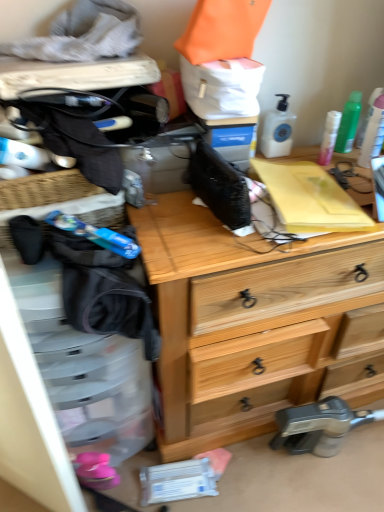
Question: Is green matte spray can at upper right, the 3th toiletry from the left, looking in the opposite direction of wooden chest of drawers at center?

Choices:
 (A) no
 (B) yes

Answer: (A)

Question: From a real-world perspective, is green matte spray can at upper right, the second toiletry when ordered from right to left, physically above wooden chest of drawers at center?

Choices:
 (A) no
 (B) yes

Answer: (B)

Question: Is green matte spray can at upper right, the second toiletry when ordered from right to left, not near wooden chest of drawers at center?

Choices:
 (A) yes
 (B) no

Answer: (B)

Question: Does green matte spray can at upper right, the 3th toiletry from the left, have a smaller size compared to wooden chest of drawers at center?

Choices:
 (A) no
 (B) yes

Answer: (B)

Question: Is green matte spray can at upper right, the 3th toiletry from the left, thinner than wooden chest of drawers at center?

Choices:
 (A) no
 (B) yes

Answer: (B)

Question: From the image's perspective, is green matte spray can at upper right, the 3th toiletry from the left, located above wooden chest of drawers at center?

Choices:
 (A) no
 (B) yes

Answer: (B)

Question: Is green plastic spray can at upper right, marked as the 1th toiletry in a right-to-left arrangement, at the left side of pink matte lotion at upper right, marked as the second toiletry in a left-to-right arrangement?

Choices:
 (A) yes
 (B) no

Answer: (B)

Question: From a real-world perspective, is green plastic spray can at upper right, marked as the 1th toiletry in a right-to-left arrangement, beneath pink matte lotion at upper right, marked as the second toiletry in a left-to-right arrangement?

Choices:
 (A) no
 (B) yes

Answer: (A)

Question: Can you confirm if green plastic spray can at upper right, acting as the fourth toiletry starting from the left, is bigger than pink matte lotion at upper right, the 3th toiletry viewed from the right?

Choices:
 (A) yes
 (B) no

Answer: (A)

Question: Can you confirm if green plastic spray can at upper right, acting as the fourth toiletry starting from the left, is smaller than pink matte lotion at upper right, the 3th toiletry viewed from the right?

Choices:
 (A) no
 (B) yes

Answer: (A)

Question: Is pink matte lotion at upper right, the 3th toiletry viewed from the right, at the back of green plastic spray can at upper right, marked as the 1th toiletry in a right-to-left arrangement?

Choices:
 (A) no
 (B) yes

Answer: (A)

Question: From the image's perspective, is green plastic spray can at upper right, acting as the fourth toiletry starting from the left, under pink matte lotion at upper right, marked as the second toiletry in a left-to-right arrangement?

Choices:
 (A) yes
 (B) no

Answer: (B)

Question: Does green plastic spray can at upper right, marked as the 1th toiletry in a right-to-left arrangement, lie in front of white plastic pump bottle at upper right, arranged as the 4th toiletry when viewed from the right?

Choices:
 (A) yes
 (B) no

Answer: (A)